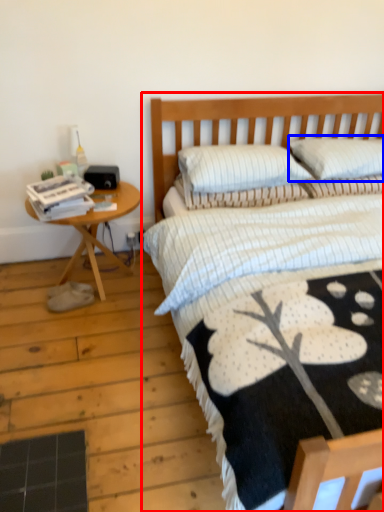
Question: Which point is closer to the camera, bed (highlighted by a red box) or pillow (highlighted by a blue box)?

Choices:
 (A) bed
 (B) pillow

Answer: (A)